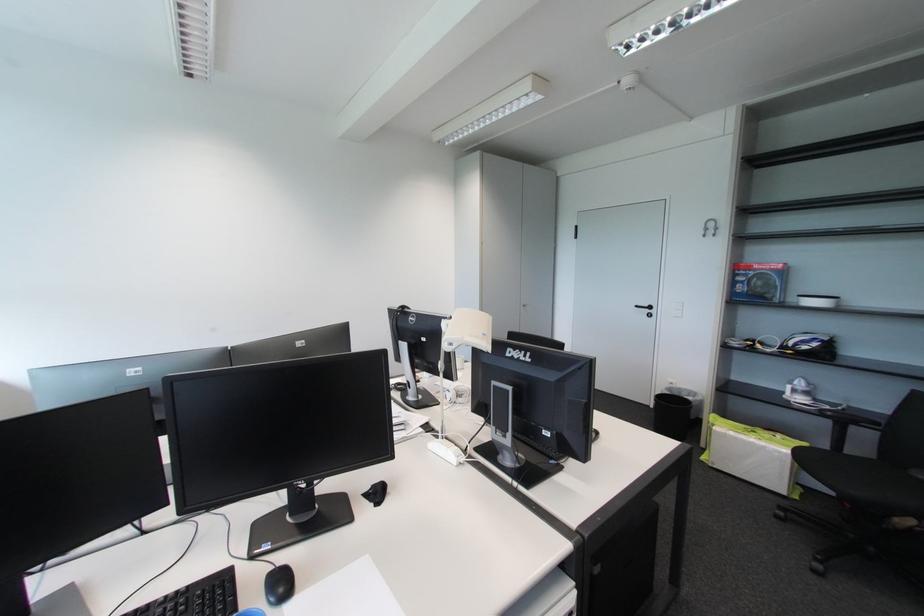
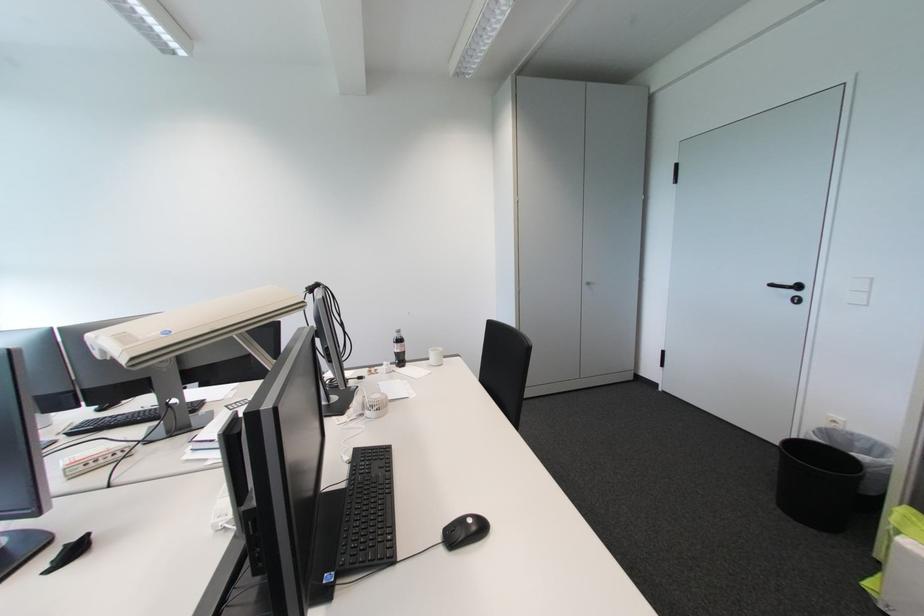
The images are taken continuously from a first-person perspective. In which direction are you moving?

The movement direction of the cameraman is right, forward.